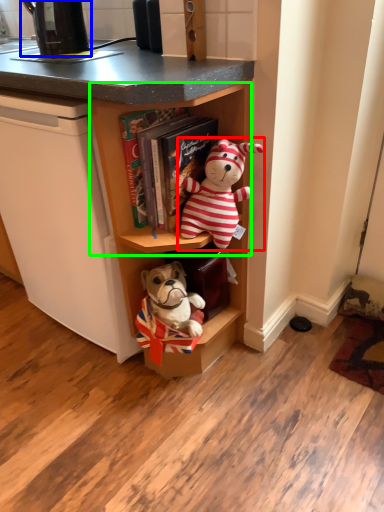
Question: Estimate the real-world distances between objects in this image. Which object is farther from toy (highlighted by a red box), appliance (highlighted by a blue box) or cabinet (highlighted by a green box)?

Choices:
 (A) appliance
 (B) cabinet

Answer: (A)